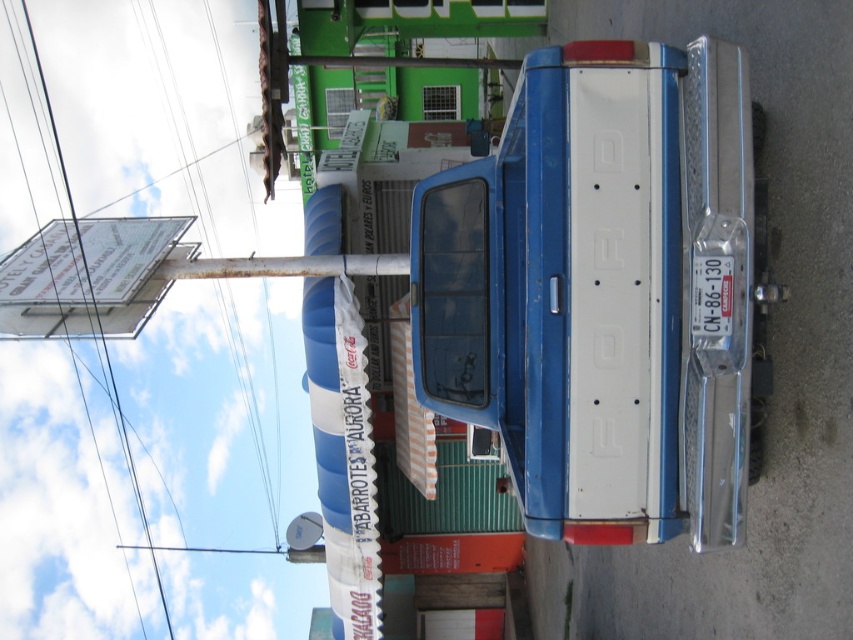
Question: Based on their relative distances, which object is farther from the metallic wire at upper left?

Choices:
 (A) white wire at upper left
 (B) blue metallic truck at center

Answer: (B)

Question: Can you confirm if white wire at upper left is bigger than metallic wire at upper left?

Choices:
 (A) no
 (B) yes

Answer: (A)

Question: Is blue metallic truck at center smaller than white wire at upper left?

Choices:
 (A) yes
 (B) no

Answer: (A)

Question: Which point is farther to the camera?

Choices:
 (A) white wire at upper left
 (B) blue metallic truck at center

Answer: (A)

Question: Which object is positioned closest to the blue metallic truck at center?

Choices:
 (A) white wire at upper left
 (B) metallic wire at upper left

Answer: (B)

Question: Does white wire at upper left have a lesser width compared to metallic wire at upper left?

Choices:
 (A) yes
 (B) no

Answer: (A)